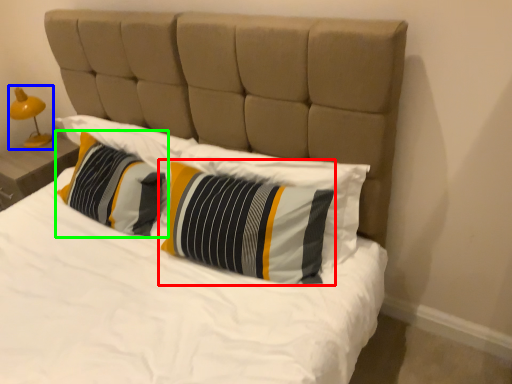
Question: Based on their relative distances, which object is farther from pillow (highlighted by a red box)? Choose from bedside lamp (highlighted by a blue box) and pillow (highlighted by a green box).

Choices:
 (A) bedside lamp
 (B) pillow

Answer: (A)